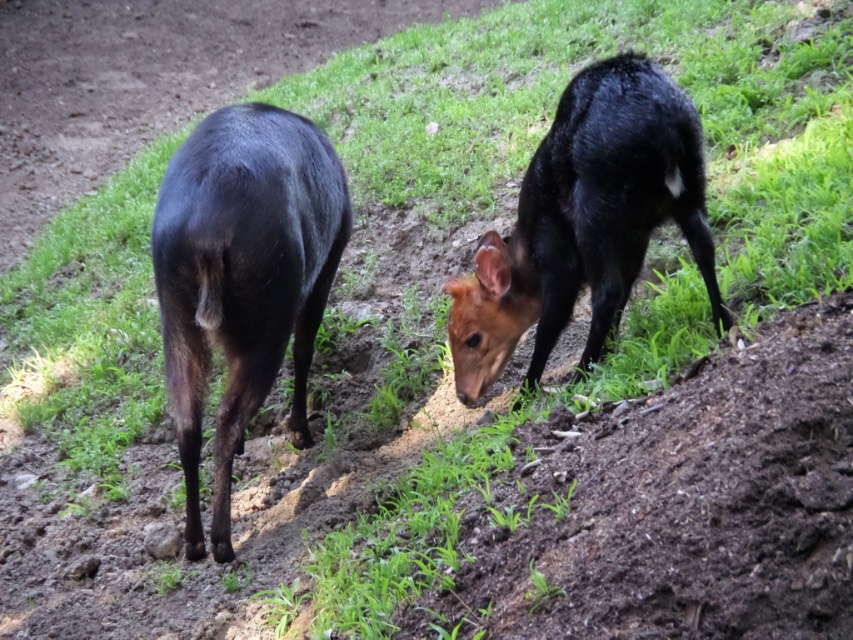
You are a wildlife photographer aiming to capture a closeup shot of the shiny black deer at left and the shiny black deer at center. Based on their positions, which deer would require you to zoom in less to fill the frame?

→ The shiny black deer at left is closer to the viewer than the shiny black deer at center, so you would need to zoom in less to capture the shiny black deer at left in the frame.

You are a wildlife photographer trying to capture a photo of the shiny black deer at left and the shiny black deer at center. Which deer should you focus on first if you want to photograph the larger one?

The shiny black deer at left is bigger than the shiny black deer at center, so you should focus on the shiny black deer at left first to photograph the larger one.